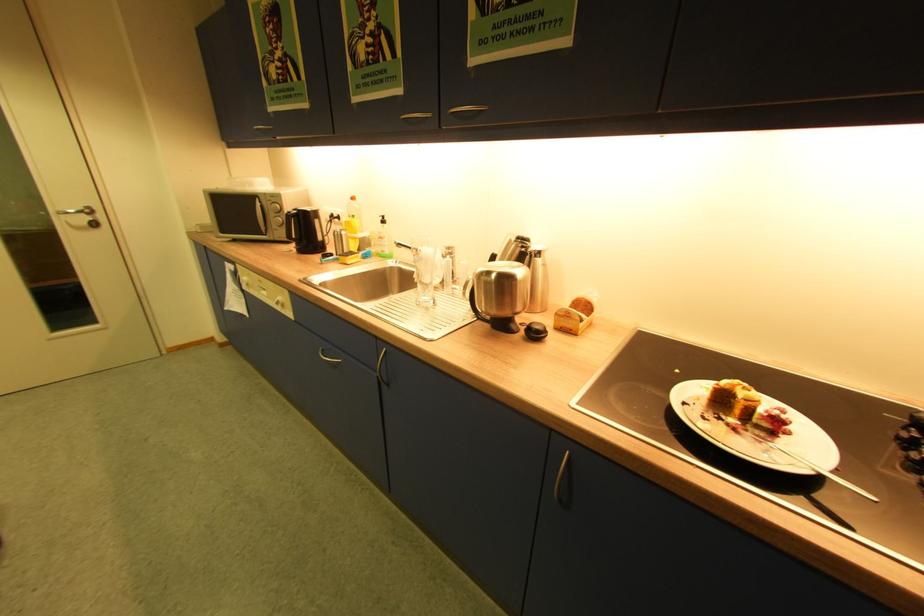
Identify the location of silver thermos handle. The image size is (924, 616). (410, 111).